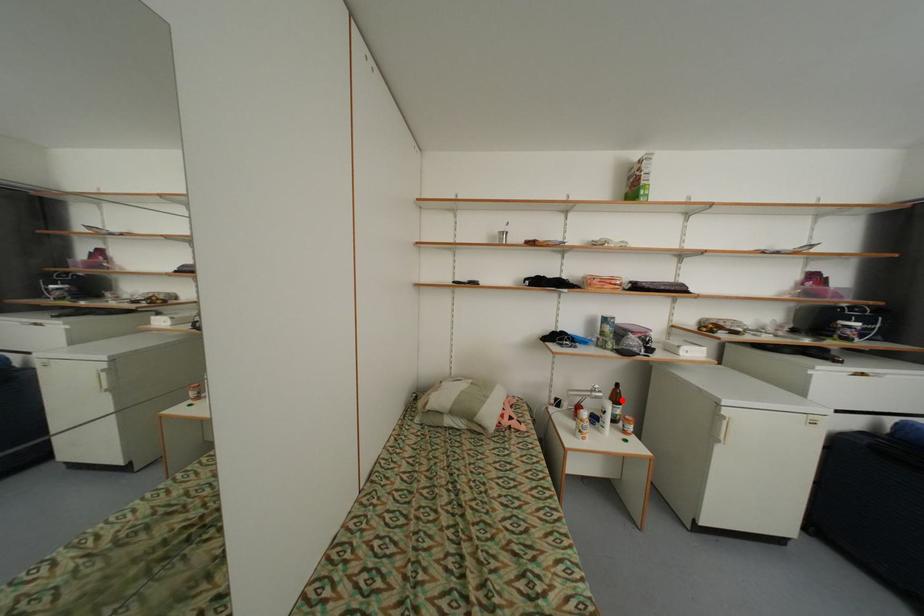
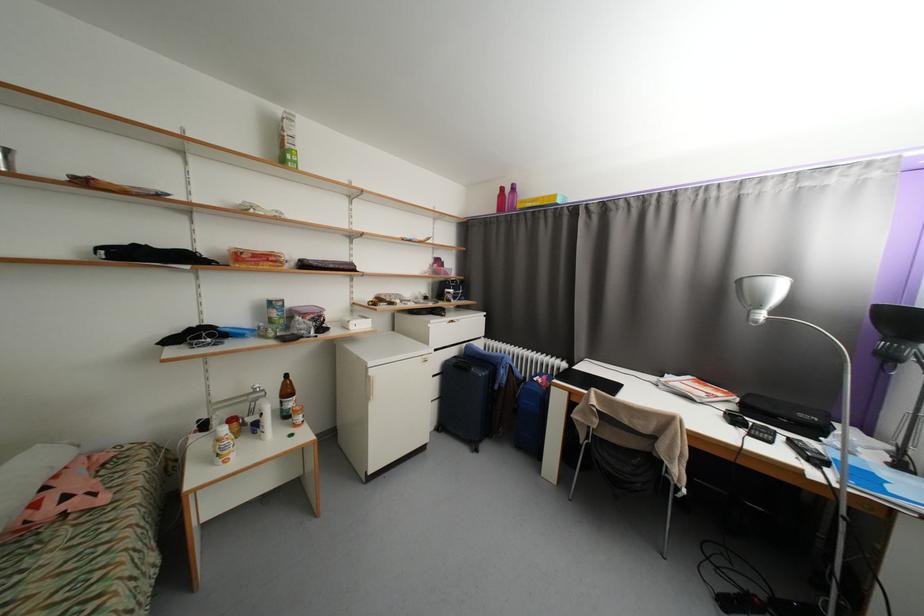
Question: I am providing you with two images of the same scene from different viewpoints. A red point is shown in image1. For the corresponding object point in image2, is it positioned nearer or farther from the camera?

Choices:
 (A) Nearer
 (B) Farther

Answer: (A)